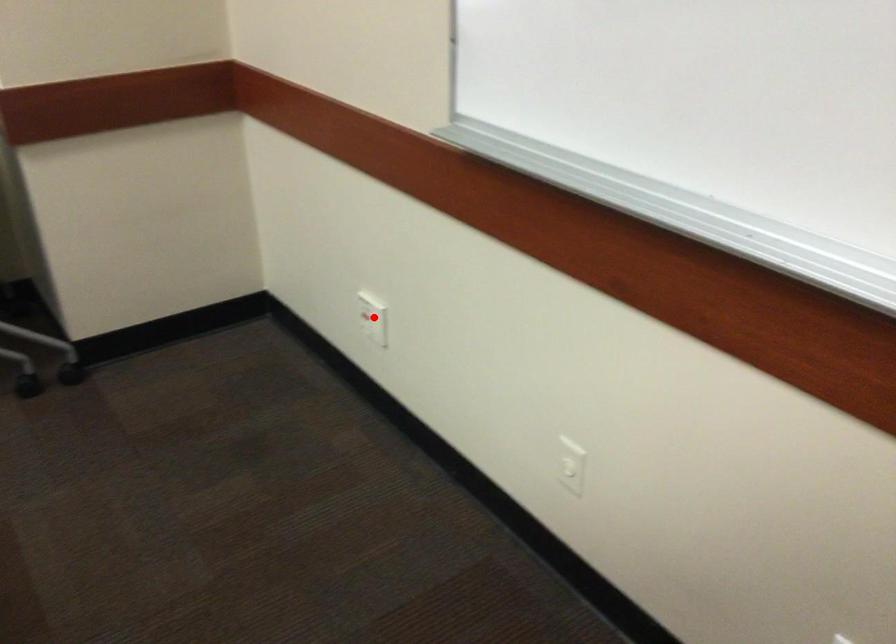
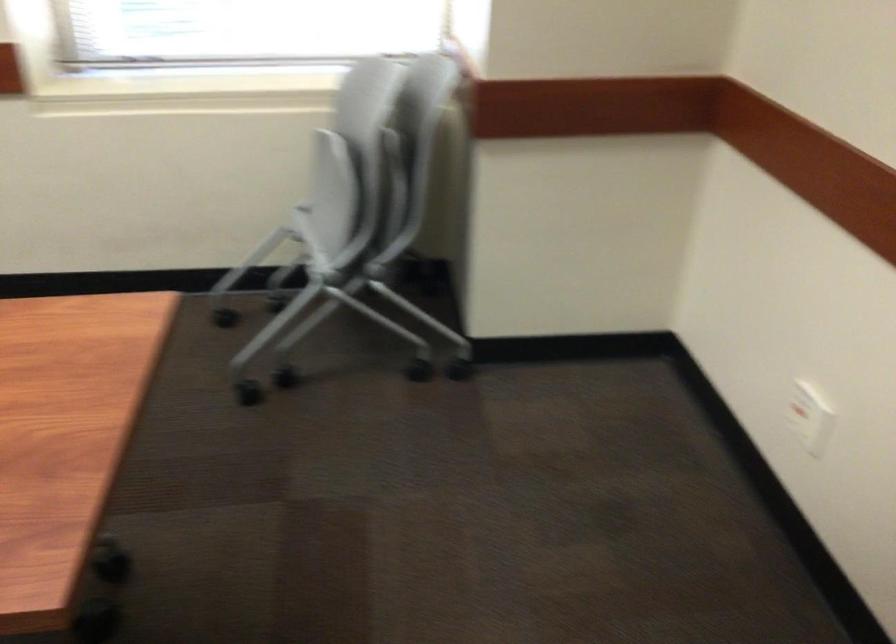
Question: I am providing you with two images of the same scene from different viewpoints. Image1 has a red point marked. In image2, the corresponding 3D location appears at what relative position? Reply with the corresponding letter.

Choices:
 (A) Closer
 (B) Farther

Answer: (A)